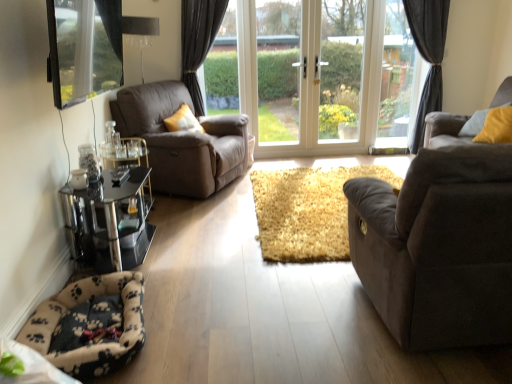
Where is `vacant area that lies to the right of fluffy beige and black paw print cat bed at lower left, the first cat bed viewed from the left`? The image size is (512, 384). vacant area that lies to the right of fluffy beige and black paw print cat bed at lower left, the first cat bed viewed from the left is located at coordinates (201, 340).